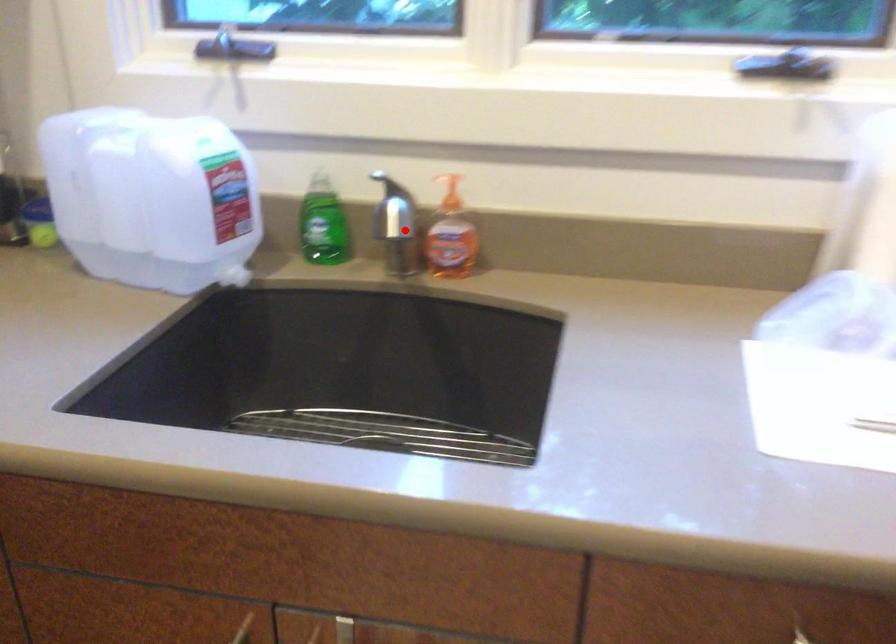
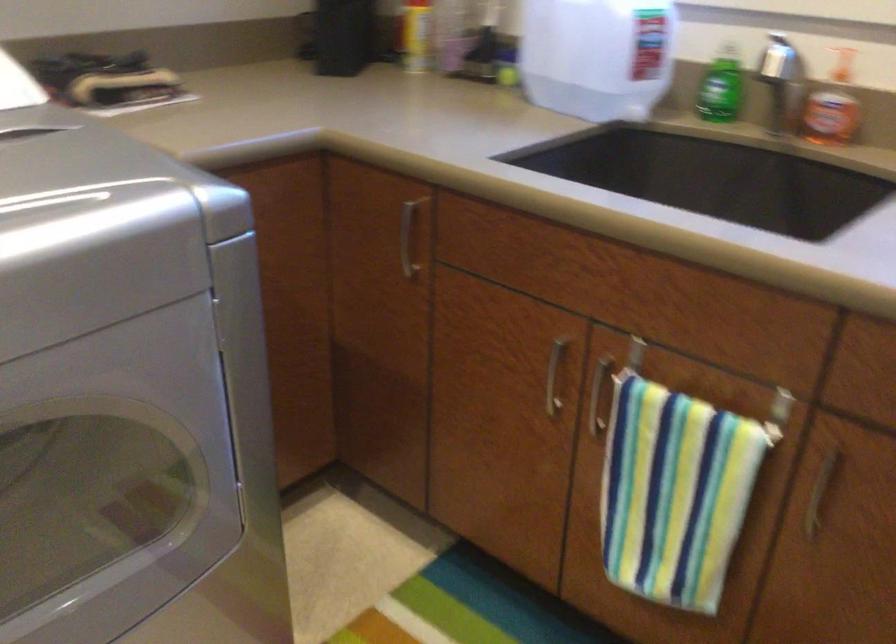
Question: A red point is marked in image1. In image2, is the corresponding 3D point closer to the camera or farther? Reply with the corresponding letter.

Choices:
 (A) The corresponding 3D point is closer.
 (B) The corresponding 3D point is farther.

Answer: (B)